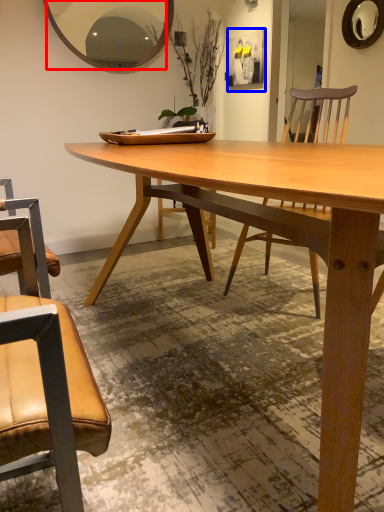
Question: Which object appears closest to the camera in this image, mirror (highlighted by a red box) or picture frame (highlighted by a blue box)?

Choices:
 (A) mirror
 (B) picture frame

Answer: (A)